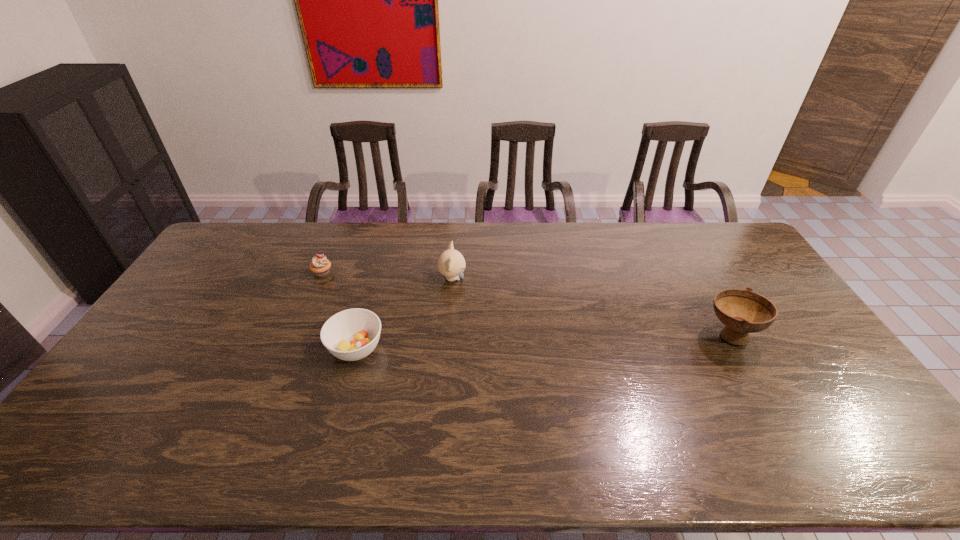
Where is `free space at the far edge`? The height and width of the screenshot is (540, 960). free space at the far edge is located at coordinates (467, 249).

Locate an element on the screen. This screenshot has height=540, width=960. free region at the near edge is located at coordinates (221, 470).

Identify the location of vacant space at the left edge. (158, 380).

This screenshot has width=960, height=540. Identify the location of free location at the right edge. (795, 316).

I want to click on vacant space at the far left corner, so click(x=254, y=251).

In the image, there is a desktop. In order to click on vacant space at the near right corner in this screenshot , I will do `click(852, 471)`.

Identify the location of free space between the kitten and the right soup bowl. point(591,307).

The width and height of the screenshot is (960, 540). I want to click on empty location between the second object from right to left and the rightmost object, so click(x=591, y=307).

Identify the location of vacant area that lies between the kitten and the right soup bowl. The height and width of the screenshot is (540, 960). (591, 307).

At what (x,y) coordinates should I click in order to perform the action: click on free space between the cupcake and the second object from left to right. Please return your answer as a coordinate pair (x, y). This screenshot has height=540, width=960. Looking at the image, I should click on (339, 310).